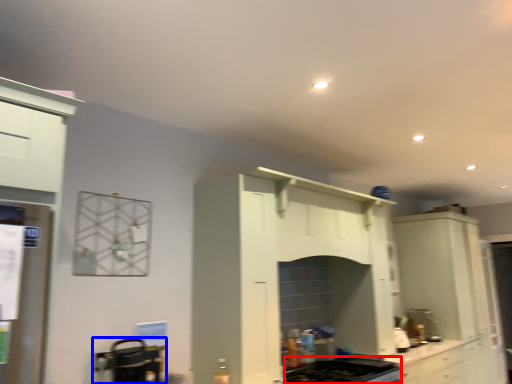
Question: Which point is closer to the camera, gas stove (highlighted by a red box) or appliance (highlighted by a blue box)?

Choices:
 (A) gas stove
 (B) appliance

Answer: (B)